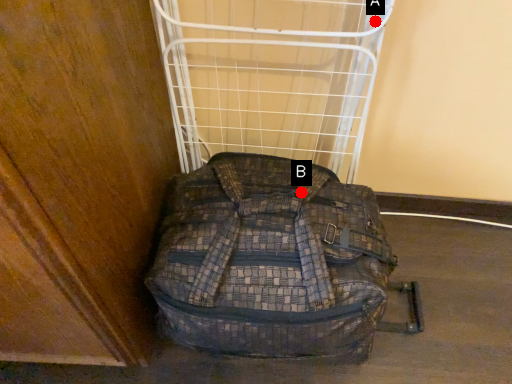
Question: Two points are circled on the image, labeled by A and B beside each circle. Which point appears farthest from the camera in this image?

Choices:
 (A) A is further
 (B) B is further

Answer: (B)